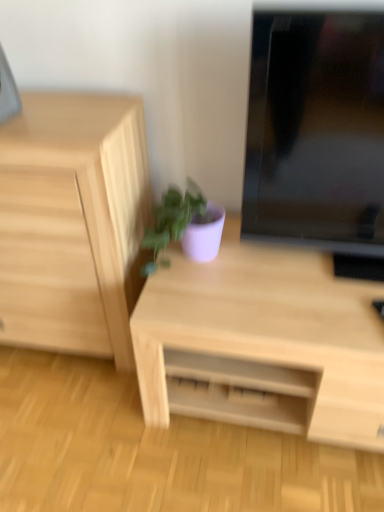
Describe the element at coordinates (73, 222) in the screenshot. The width and height of the screenshot is (384, 512). I see `light wood chest of drawers at left` at that location.

What do you see at coordinates (262, 343) in the screenshot? I see `light wood desk at center` at bounding box center [262, 343].

At what (x,y) coordinates should I click in order to perform the action: click on black glossy monitor at upper right. Please return your answer as a coordinate pair (x, y). Looking at the image, I should click on (318, 135).

How different are the orientations of black glossy monitor at upper right and light wood desk at center in degrees?

There is a 0.000358-degree angle between the facing directions of black glossy monitor at upper right and light wood desk at center.

From a real-world perspective, is black glossy monitor at upper right on top of light wood desk at center?

Yes, from a real-world perspective, black glossy monitor at upper right is over light wood desk at center

Considering the relative positions of black glossy monitor at upper right and light wood desk at center in the image provided, is black glossy monitor at upper right behind light wood desk at center?

No.

Is black glossy monitor at upper right looking in the opposite direction of light wood desk at center?

black glossy monitor at upper right is not turned away from light wood desk at center.

Is point (263, 383) closer or farther from the camera than point (16, 271)?

Clearly, point (263, 383) is closer to the camera than point (16, 271).

From a real-world perspective, is light wood desk at center positioned over light wood chest of drawers at left based on gravity?

No.

Is light wood desk at center smaller than light wood chest of drawers at left?

Yes.

From the image's perspective, does light wood desk at center appear lower than light wood chest of drawers at left?

Yes, from the image's perspective, light wood desk at center is beneath light wood chest of drawers at left.

Which of these two, light wood desk at center or black glossy monitor at upper right, is smaller?

black glossy monitor at upper right.

Which point is more distant from viewer, [240,411] or [267,210]?

Point [240,411]

Is black glossy monitor at upper right located within light wood desk at center?

No, light wood desk at center does not contain black glossy monitor at upper right.

From the image's perspective, which object appears higher, light wood desk at center or black glossy monitor at upper right?

black glossy monitor at upper right is shown above in the image.

From the image's perspective, would you say light wood chest of drawers at left is positioned over matte purple pot at center?

Incorrect, from the image's perspective, light wood chest of drawers at left is lower than matte purple pot at center.

Can you tell me how much light wood chest of drawers at left and matte purple pot at center differ in facing direction?

light wood chest of drawers at left and matte purple pot at center are facing 0.00016 degrees away from each other.

Looking at their sizes, would you say light wood chest of drawers at left is wider or thinner than matte purple pot at center?

Clearly, light wood chest of drawers at left has more width compared to matte purple pot at center.

In the scene shown: Considering the sizes of light wood chest of drawers at left and matte purple pot at center in the image, is light wood chest of drawers at left taller or shorter than matte purple pot at center?

Clearly, light wood chest of drawers at left is taller compared to matte purple pot at center.

From a real-world perspective, is matte purple pot at center over light wood desk at center?

Yes.

This screenshot has width=384, height=512. Find the location of `desk lying on the right of matte purple pot at center`. desk lying on the right of matte purple pot at center is located at coordinates (262, 343).

Is matte purple pot at center looking in the opposite direction of light wood desk at center?

matte purple pot at center does not have its back to light wood desk at center.

From the image's perspective, is matte purple pot at center on top of light wood desk at center?

Indeed, from the image's perspective, matte purple pot at center is shown above light wood desk at center.

From the image's perspective, is black glossy monitor at upper right over matte purple pot at center?

Yes.

Is black glossy monitor at upper right in contact with matte purple pot at center?

No, black glossy monitor at upper right is not next to matte purple pot at center.

Is black glossy monitor at upper right bigger or smaller than matte purple pot at center?

black glossy monitor at upper right is bigger than matte purple pot at center.

Does matte purple pot at center have a lesser height compared to black glossy monitor at upper right?

Yes, matte purple pot at center is shorter than black glossy monitor at upper right.

Considering the sizes of matte purple pot at center and black glossy monitor at upper right in the image, is matte purple pot at center wider or thinner than black glossy monitor at upper right?

matte purple pot at center is thinner than black glossy monitor at upper right.

Between point (203, 195) and point (275, 220), which one is positioned behind?

The point (203, 195) is farther from the camera.

From a real-world perspective, which object rests below the other?

matte purple pot at center is physically lower.

The height and width of the screenshot is (512, 384). Identify the location of computer monitor lying on the right of light wood desk at center. (318, 135).

The height and width of the screenshot is (512, 384). I want to click on desk below the light wood chest of drawers at left (from a real-world perspective), so click(262, 343).

Which object lies nearer to the anchor point light wood desk at center, matte purple pot at center or black glossy monitor at upper right?

Among the two, matte purple pot at center is located nearer to light wood desk at center.

Based on their spatial positions, is matte purple pot at center or light wood desk at center closer to black glossy monitor at upper right?

matte purple pot at center is closer to black glossy monitor at upper right.

Looking at the image, which one is located further to light wood desk at center, light wood chest of drawers at left or black glossy monitor at upper right?

Based on the image, light wood chest of drawers at left appears to be further to light wood desk at center.

When comparing their distances from light wood chest of drawers at left, does black glossy monitor at upper right or light wood desk at center seem closer?

light wood desk at center is closer to light wood chest of drawers at left.

Estimate the real-world distances between objects in this image. Which object is further from light wood desk at center, light wood chest of drawers at left or matte purple pot at center?

Based on the image, light wood chest of drawers at left appears to be further to light wood desk at center.

From the image, which object appears to be farther from black glossy monitor at upper right, matte purple pot at center or light wood chest of drawers at left?

light wood chest of drawers at left.

Estimate the real-world distances between objects in this image. Which object is closer to light wood chest of drawers at left, light wood desk at center or black glossy monitor at upper right?

Based on the image, light wood desk at center appears to be nearer to light wood chest of drawers at left.

Estimate the real-world distances between objects in this image. Which object is closer to black glossy monitor at upper right, light wood chest of drawers at left or light wood desk at center?

light wood desk at center is closer to black glossy monitor at upper right.

I want to click on desk situated between light wood chest of drawers at left and black glossy monitor at upper right from left to right, so click(262, 343).

Identify the location of houseplant between light wood chest of drawers at left and black glossy monitor at upper right. (184, 225).

Image resolution: width=384 pixels, height=512 pixels. Find the location of `houseplant between light wood chest of drawers at left and light wood desk at center from left to right`. houseplant between light wood chest of drawers at left and light wood desk at center from left to right is located at coordinates (184, 225).

This screenshot has width=384, height=512. I want to click on houseplant between black glossy monitor at upper right and light wood desk at center in the vertical direction, so click(184, 225).